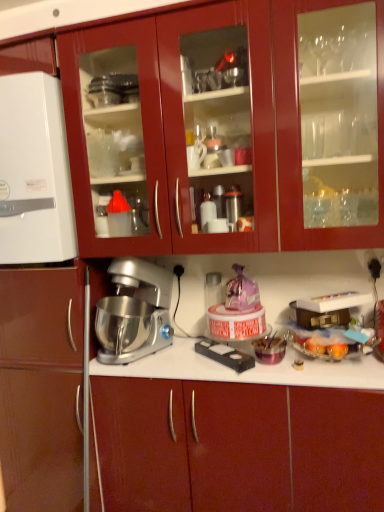
What are the coordinates of `free region under silver metallic stand mixer at center (from a real-world perspective)` in the screenshot? It's located at (130, 361).